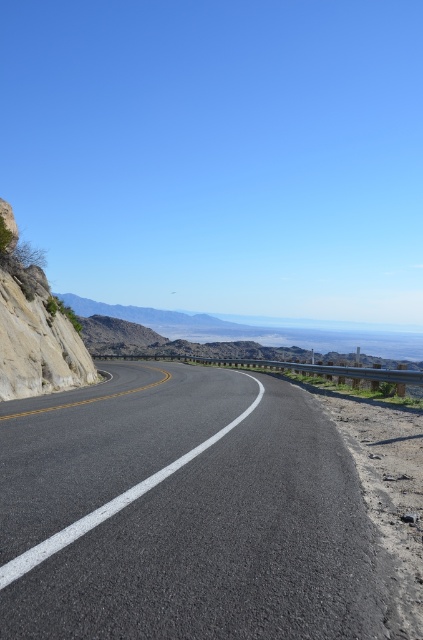
Question: Does black asphalt road at center appear on the right side of rocky cliff at left?

Choices:
 (A) no
 (B) yes

Answer: (B)

Question: Is black asphalt road at center closer to the viewer compared to rocky cliff at left?

Choices:
 (A) yes
 (B) no

Answer: (A)

Question: Which point is farther to the camera?

Choices:
 (A) black asphalt road at center
 (B) rocky cliff at left

Answer: (B)

Question: In this image, where is black asphalt road at center located relative to rocky cliff at left?

Choices:
 (A) right
 (B) left

Answer: (A)